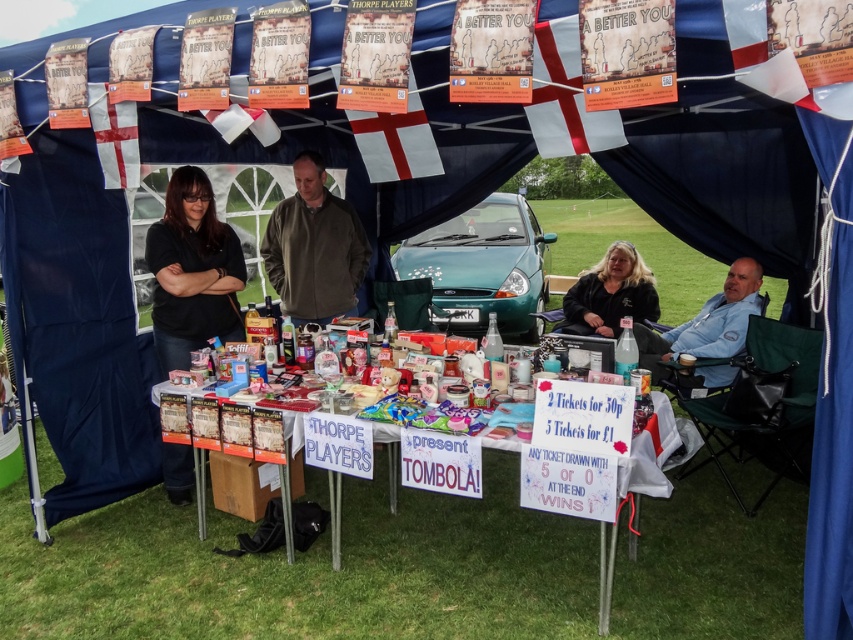
Question: Estimate the real-world distances between objects in this image. Which object is closer to the blue fabric chair at right?

Choices:
 (A) black matte shirt at left
 (B) metallic silver table at center

Answer: (B)

Question: In this image, where is black matte shirt at left located relative to black fabric at center?

Choices:
 (A) above
 (B) below

Answer: (A)

Question: Can you confirm if green metallic car at center is positioned to the right of blue fabric chair at right?

Choices:
 (A) yes
 (B) no

Answer: (B)

Question: Is metallic silver table at center to the left of black matte shirt at left from the viewer's perspective?

Choices:
 (A) no
 (B) yes

Answer: (A)

Question: Which of these objects is positioned farthest from the blue fabric chair at right?

Choices:
 (A) black matte shirt at left
 (B) green metallic car at center
 (C) metallic silver table at center

Answer: (A)

Question: Estimate the real-world distances between objects in this image. Which object is farther from the green fleece jacket at center?

Choices:
 (A) black fabric at center
 (B) black matte shirt at left

Answer: (A)